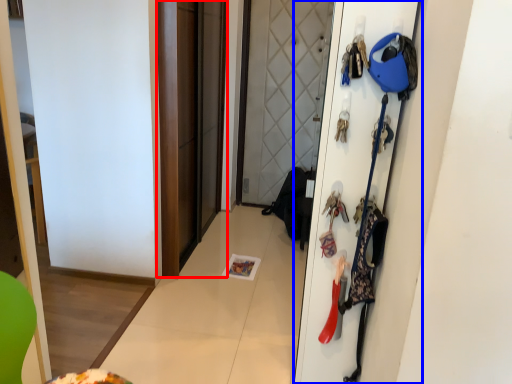
Question: Which object appears closest to the camera in this image, screen door (highlighted by a red box) or door (highlighted by a blue box)?

Choices:
 (A) screen door
 (B) door

Answer: (B)